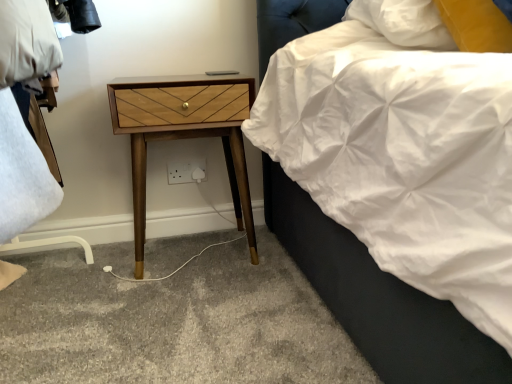
Question: Relative to woodenmaterial/texturenightstand at left, is white plastic electric outlet at lower center in front or behind?

Choices:
 (A) behind
 (B) front

Answer: (A)

Question: From a real-world perspective, is white plastic electric outlet at lower center physically located above or below woodenmaterial/texturenightstand at left?

Choices:
 (A) above
 (B) below

Answer: (B)

Question: Is white plastic electric outlet at lower center wider or thinner than woodenmaterial/texturenightstand at left?

Choices:
 (A) wide
 (B) thin

Answer: (B)

Question: Considering the positions of point (237, 210) and point (188, 165), is point (237, 210) closer or farther from the camera than point (188, 165)?

Choices:
 (A) closer
 (B) farther

Answer: (B)

Question: Considering their positions, is woodenmaterial/texturenightstand at left located in front of or behind white plastic electric outlet at lower center?

Choices:
 (A) front
 (B) behind

Answer: (A)

Question: From the image's perspective, is woodenmaterial/texturenightstand at left above or below white plastic electric outlet at lower center?

Choices:
 (A) above
 (B) below

Answer: (A)

Question: Is woodenmaterial/texturenightstand at left wider or thinner than white plastic electric outlet at lower center?

Choices:
 (A) wide
 (B) thin

Answer: (A)